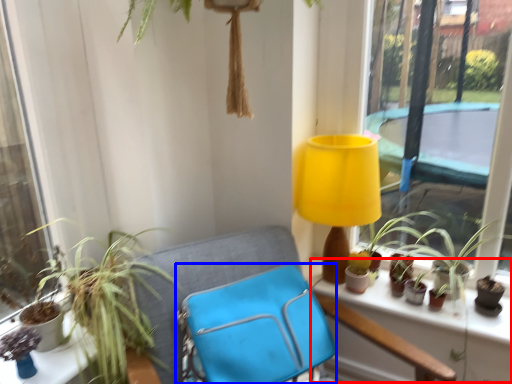
Question: Which object appears closest to the camera in this image, window sill (highlighted by a red box) or folding chair (highlighted by a blue box)?

Choices:
 (A) window sill
 (B) folding chair

Answer: (B)